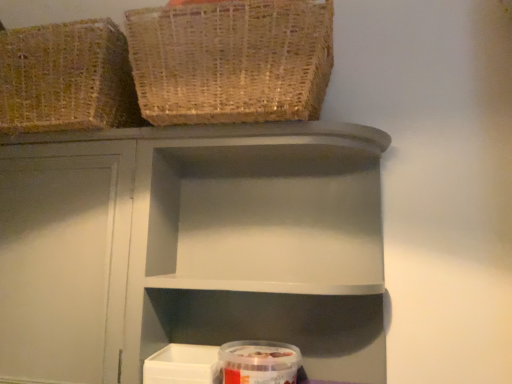
What do you see at coordinates (66, 78) in the screenshot? I see `woven natural basket at upper left, the 1th basket in the left-to-right sequence` at bounding box center [66, 78].

The height and width of the screenshot is (384, 512). What are the coordinates of `woven natural basket at upper left, acting as the 1th basket starting from the right` in the screenshot? It's located at (231, 60).

In order to click on matte gray shelf at center in this screenshot , I will do `click(191, 247)`.

Considering the sizes of objects woven natural basket at upper left, which is the second basket in right-to-left order, and matte gray shelf at center in the image provided, who is thinner, woven natural basket at upper left, which is the second basket in right-to-left order, or matte gray shelf at center?

matte gray shelf at center.

Which point is more forward, (67, 122) or (332, 317)?

Point (67, 122)

How many degrees apart are the facing directions of woven natural basket at upper left, which is the second basket in right-to-left order, and matte gray shelf at center?

There is a 0.276-degree angle between the facing directions of woven natural basket at upper left, which is the second basket in right-to-left order, and matte gray shelf at center.

Is woven natural basket at upper left, which is the second basket in right-to-left order, located outside matte gray shelf at center?

Indeed, woven natural basket at upper left, which is the second basket in right-to-left order, is completely outside matte gray shelf at center.

Is woven natural basket at upper left, which is the second basket in right-to-left order, oriented away from transparent plastic container at lower center?

woven natural basket at upper left, which is the second basket in right-to-left order, is not turned away from transparent plastic container at lower center.

Consider the image. Would you say woven natural basket at upper left, which is the second basket in right-to-left order, is outside transparent plastic container at lower center?

Yes, woven natural basket at upper left, which is the second basket in right-to-left order, is located beyond the bounds of transparent plastic container at lower center.

From a real-world perspective, is woven natural basket at upper left, the 1th basket in the left-to-right sequence, physically located above or below transparent plastic container at lower center?

woven natural basket at upper left, the 1th basket in the left-to-right sequence, is situated higher than transparent plastic container at lower center in the real world.

Between woven natural basket at upper left, the 1th basket in the left-to-right sequence, and transparent plastic container at lower center, which one has less height?

transparent plastic container at lower center is shorter.

Considering the relative sizes of woven natural basket at upper left, the 1th basket in the left-to-right sequence, and woven natural basket at upper left, arranged as the 2th basket when viewed from the left, in the image provided, is woven natural basket at upper left, the 1th basket in the left-to-right sequence, wider than woven natural basket at upper left, arranged as the 2th basket when viewed from the left,?

Incorrect, the width of woven natural basket at upper left, the 1th basket in the left-to-right sequence, does not surpass that of woven natural basket at upper left, arranged as the 2th basket when viewed from the left.

Considering the points (42, 124) and (177, 87), which point is in front, point (42, 124) or point (177, 87)?

The point (177, 87) is closer to the camera.

Considering the sizes of objects woven natural basket at upper left, the 1th basket in the left-to-right sequence, and woven natural basket at upper left, arranged as the 2th basket when viewed from the left, in the image provided, who is shorter, woven natural basket at upper left, the 1th basket in the left-to-right sequence, or woven natural basket at upper left, arranged as the 2th basket when viewed from the left,?

With less height is woven natural basket at upper left, arranged as the 2th basket when viewed from the left.

Is point (145, 179) less distant than point (51, 114)?

No, it is behind (51, 114).

Considering the sizes of objects matte gray shelf at center and woven natural basket at upper left, the 1th basket in the left-to-right sequence, in the image provided, who is thinner, matte gray shelf at center or woven natural basket at upper left, the 1th basket in the left-to-right sequence,?

matte gray shelf at center.

Is matte gray shelf at center next to woven natural basket at upper left, which is the second basket in right-to-left order, and touching it?

There is a gap between matte gray shelf at center and woven natural basket at upper left, which is the second basket in right-to-left order.

Looking at this image, looking at the image, does woven natural basket at upper left, arranged as the 2th basket when viewed from the left, seem bigger or smaller compared to matte gray shelf at center?

Clearly, woven natural basket at upper left, arranged as the 2th basket when viewed from the left, is smaller in size than matte gray shelf at center.

Is woven natural basket at upper left, arranged as the 2th basket when viewed from the left, facing away from matte gray shelf at center?

That's not correct — woven natural basket at upper left, arranged as the 2th basket when viewed from the left, is not looking away from matte gray shelf at center.

Is woven natural basket at upper left, arranged as the 2th basket when viewed from the left, completely or partially outside of matte gray shelf at center?

woven natural basket at upper left, arranged as the 2th basket when viewed from the left, is positioned outside matte gray shelf at center.

Is point (301, 102) positioned in front of point (245, 211)?

Yes, it is.

Would you say matte gray shelf at center is to the left or to the right of transparent plastic container at lower center in the picture?

Based on their positions, matte gray shelf at center is located to the right of transparent plastic container at lower center.

Find the location of a particular element. The width and height of the screenshot is (512, 384). shelf above the transparent plastic container at lower center (from a real-world perspective) is located at coordinates (191, 247).

From the image's perspective, between matte gray shelf at center and transparent plastic container at lower center, who is located below?

transparent plastic container at lower center appears lower in the image.

Would you say matte gray shelf at center is inside or outside transparent plastic container at lower center?

matte gray shelf at center is located beyond the bounds of transparent plastic container at lower center.

From the picture: Relative to matte gray shelf at center, is transparent plastic container at lower center in front or behind?

transparent plastic container at lower center is positioned farther from the viewer than matte gray shelf at center.

Measure the distance between transparent plastic container at lower center and matte gray shelf at center.

They are 11.42 inches apart.

Is transparent plastic container at lower center touching matte gray shelf at center?

No.

Is transparent plastic container at lower center taller than matte gray shelf at center?

No, transparent plastic container at lower center is not taller than matte gray shelf at center.

Identify the location of the 2nd basket above the matte gray shelf at center (from the image's perspective). (66, 78).

Image resolution: width=512 pixels, height=384 pixels. I want to click on glass jar that is in front of the woven natural basket at upper left, the 1th basket in the left-to-right sequence, so click(x=259, y=362).

Based on their spatial positions, is woven natural basket at upper left, the 1th basket in the left-to-right sequence, or matte gray shelf at center further from transparent plastic container at lower center?

Among the two, woven natural basket at upper left, the 1th basket in the left-to-right sequence, is located further to transparent plastic container at lower center.

Estimate the real-world distances between objects in this image. Which object is further from woven natural basket at upper left, the 1th basket in the left-to-right sequence, matte gray shelf at center or transparent plastic container at lower center?

transparent plastic container at lower center is further to woven natural basket at upper left, the 1th basket in the left-to-right sequence.

Considering their positions, is woven natural basket at upper left, the 1th basket in the left-to-right sequence, positioned further to transparent plastic container at lower center than woven natural basket at upper left, arranged as the 2th basket when viewed from the left?

The object further to transparent plastic container at lower center is woven natural basket at upper left, the 1th basket in the left-to-right sequence.

Looking at the image, which one is located closer to woven natural basket at upper left, arranged as the 2th basket when viewed from the left, matte gray shelf at center or transparent plastic container at lower center?

matte gray shelf at center.

Considering their positions, is woven natural basket at upper left, arranged as the 2th basket when viewed from the left, positioned closer to transparent plastic container at lower center than woven natural basket at upper left, which is the second basket in right-to-left order?

woven natural basket at upper left, arranged as the 2th basket when viewed from the left, is positioned closer to the anchor transparent plastic container at lower center.

When comparing their distances from woven natural basket at upper left, the 1th basket in the left-to-right sequence, does matte gray shelf at center or woven natural basket at upper left, arranged as the 2th basket when viewed from the left, seem further?

matte gray shelf at center is positioned further to the anchor woven natural basket at upper left, the 1th basket in the left-to-right sequence.

Which object lies further to the anchor point woven natural basket at upper left, which is the second basket in right-to-left order, transparent plastic container at lower center or matte gray shelf at center?

Among the two, transparent plastic container at lower center is located further to woven natural basket at upper left, which is the second basket in right-to-left order.

When comparing their distances from transparent plastic container at lower center, does woven natural basket at upper left, arranged as the 2th basket when viewed from the left, or matte gray shelf at center seem further?

Based on the image, woven natural basket at upper left, arranged as the 2th basket when viewed from the left, appears to be further to transparent plastic container at lower center.

This screenshot has height=384, width=512. Find the location of `shelf between woven natural basket at upper left, acting as the 1th basket starting from the right, and transparent plastic container at lower center in the up-down direction`. shelf between woven natural basket at upper left, acting as the 1th basket starting from the right, and transparent plastic container at lower center in the up-down direction is located at coordinates (191, 247).

I want to click on basket between woven natural basket at upper left, which is the second basket in right-to-left order, and transparent plastic container at lower center in the up-down direction, so click(x=231, y=60).

You are a GUI agent. You are given a task and a screenshot of the screen. Output one action in this format:
    pyautogui.click(x=<x>, y=<y>)
    Task: Click on the basket between woven natural basket at upper left, the 1th basket in the left-to-right sequence, and matte gray shelf at center from left to right
    
    Given the screenshot: What is the action you would take?
    pyautogui.click(x=231, y=60)

This screenshot has height=384, width=512. In order to click on shelf between woven natural basket at upper left, which is the second basket in right-to-left order, and transparent plastic container at lower center, in the vertical direction in this screenshot , I will do `click(191, 247)`.